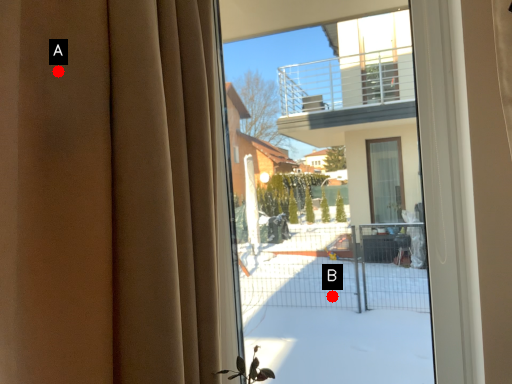
Question: Two points are circled on the image, labeled by A and B beside each circle. Which of the following is the farthest from the observer?

Choices:
 (A) A is further
 (B) B is further

Answer: (B)